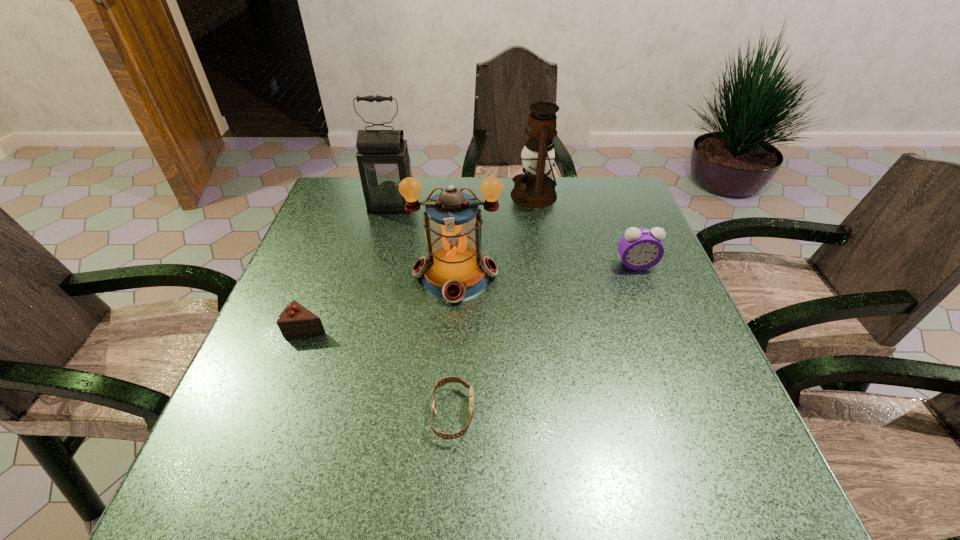
You are a GUI agent. You are given a task and a screenshot of the screen. Output one action in this format:
    pyautogui.click(x=<x>, y=<y>)
    Task: Click on the object that is at the right edge
    This screenshot has height=540, width=960.
    Given the screenshot: What is the action you would take?
    pyautogui.click(x=640, y=248)

The height and width of the screenshot is (540, 960). In order to click on object at the far left corner in this screenshot , I will do `click(383, 160)`.

Identify the location of free spot at the far edge of the desktop. The image size is (960, 540). (577, 211).

This screenshot has height=540, width=960. I want to click on free space at the near edge of the desktop, so click(x=478, y=483).

In the image, there is a desktop. At what (x,y) coordinates should I click in order to perform the action: click on vacant space at the left edge. Please return your answer as a coordinate pair (x, y). Looking at the image, I should click on (277, 378).

This screenshot has width=960, height=540. In the image, there is a desktop. In order to click on vacant space at the right edge in this screenshot , I will do `click(612, 302)`.

Where is `free spot between the rightmost object and the leftmost lantern`? free spot between the rightmost object and the leftmost lantern is located at coordinates coord(514,234).

Locate an element on the screen. free space between the watch and the leftmost lantern is located at coordinates (421, 309).

Find the location of a particular element. This screenshot has width=960, height=540. vacant point located between the third shortest object and the nearest object is located at coordinates (544, 339).

The height and width of the screenshot is (540, 960). In order to click on empty space between the fourth tallest object and the watch in this screenshot , I will do `click(544, 339)`.